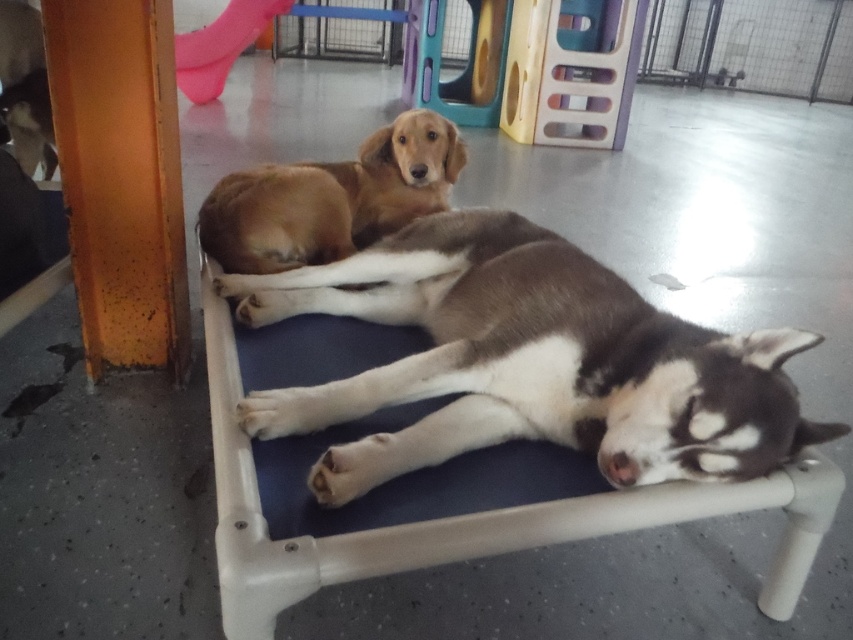
Looking at this image, you are a dog trainer assessing the height of two dogs on a raised bed. The dogs are the brown fur dog at center and the golden brown fur at center. Which dog is taller?

The brown fur dog at center is much taller than the golden brown fur at center.

You are a dog owner who wants to place a small toy between the brown fur dog at center and the golden brown fur at center on their elevated bed. Since the dogs are close, you need to ensure there is enough space. Which dog is larger, and therefore might require more space between them?

The brown fur dog at center is bigger than the golden brown fur at center, so it might require more space between them.

You are a dog owner who wants to place a small toy between the brown fur dog at center and the golden brown fur at center on the raised dog bed. Based on their positions, which dog is wider, and will the toy fit between them if it requires a 10 cm gap?

The brown fur dog at center might be wider than golden brown fur at center. However, since the exact width difference isn not specified, it is uncertain if the 10 cm gap will be sufficient. Consider measuring the space between them first.